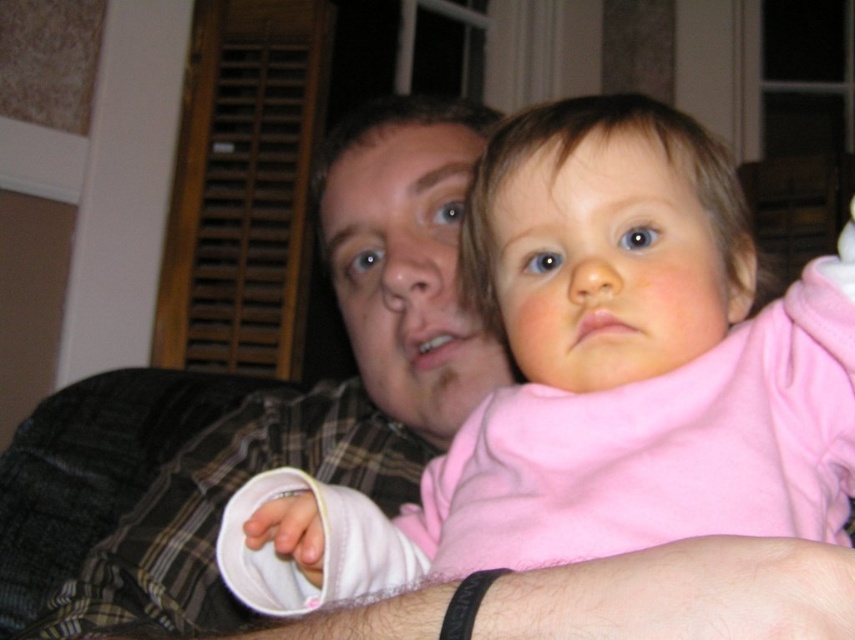
The image size is (855, 640). I want to click on pink soft fabric baby at center, so click(594, 378).

What do you see at coordinates (594, 378) in the screenshot? The width and height of the screenshot is (855, 640). I see `pink soft fabric baby at center` at bounding box center [594, 378].

Image resolution: width=855 pixels, height=640 pixels. What are the coordinates of `pink soft fabric baby at center` in the screenshot? It's located at (594, 378).